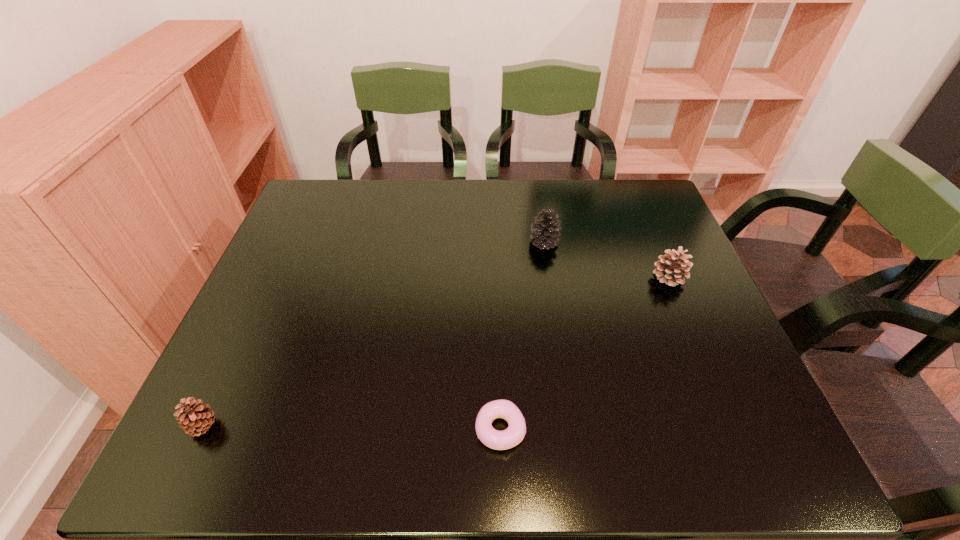
Where is `vacant area located on the back of the leftmost pinecone`? The width and height of the screenshot is (960, 540). vacant area located on the back of the leftmost pinecone is located at coordinates (265, 295).

Identify the location of free spot located 0.110m on the left of the doughnut. The height and width of the screenshot is (540, 960). (420, 429).

At what (x,y) coordinates should I click in order to perform the action: click on pinecone present at the near edge. Please return your answer as a coordinate pair (x, y). Looking at the image, I should click on (195, 419).

You are a GUI agent. You are given a task and a screenshot of the screen. Output one action in this format:
    pyautogui.click(x=<x>, y=<y>)
    Task: Click on the doughnut situated at the near edge
    Image resolution: width=960 pixels, height=540 pixels.
    Given the screenshot: What is the action you would take?
    pyautogui.click(x=499, y=440)

Identify the location of object present at the left edge. The image size is (960, 540). tap(195, 419).

Find the location of `object that is at the right edge`. object that is at the right edge is located at coordinates (670, 269).

Where is `object that is at the near left corner`? object that is at the near left corner is located at coordinates (195, 419).

You are a GUI agent. You are given a task and a screenshot of the screen. Output one action in this format:
    pyautogui.click(x=<x>, y=<y>)
    Task: Click on the vacant area at the far edge of the desktop
    
    Given the screenshot: What is the action you would take?
    pyautogui.click(x=496, y=204)

This screenshot has height=540, width=960. What are the coordinates of `vacant space at the near edge of the desktop` in the screenshot? It's located at (335, 448).

In order to click on vacant space at the left edge of the desktop in this screenshot , I will do `click(324, 234)`.